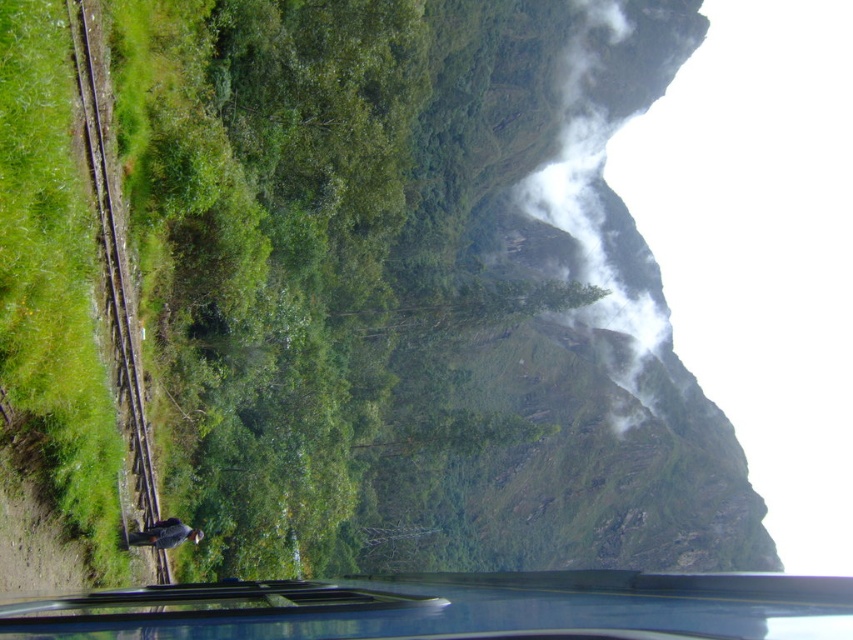
From the picture: Which is more to the left, green textured mountain at upper center or transparent glass car window at lower center?

From the viewer's perspective, transparent glass car window at lower center appears more on the left side.

Between green textured mountain at upper center and transparent glass car window at lower center, which one is positioned lower?

green textured mountain at upper center

Who is more distant from viewer, (598, 403) or (434, 582)?

The point (598, 403) is more distant.

Where is `green textured mountain at upper center`? green textured mountain at upper center is located at coordinates (567, 337).

Who is positioned more to the right, transparent glass car window at lower center or brown wooden train track at left?

transparent glass car window at lower center is more to the right.

Does transparent glass car window at lower center have a lesser height compared to brown wooden train track at left?

Correct, transparent glass car window at lower center is not as tall as brown wooden train track at left.

The height and width of the screenshot is (640, 853). I want to click on transparent glass car window at lower center, so click(x=454, y=608).

Identify the location of transparent glass car window at lower center. The height and width of the screenshot is (640, 853). (454, 608).

Can you confirm if green textured mountain at upper center is positioned below brown wooden train track at left?

Yes, green textured mountain at upper center is below brown wooden train track at left.

What are the coordinates of `green textured mountain at upper center` in the screenshot? It's located at (567, 337).